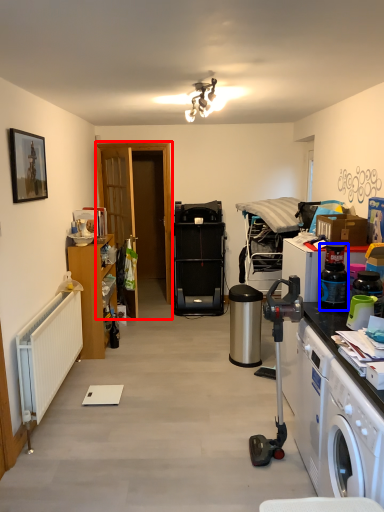
Question: Which object appears closest to the camera in this image, door (highlighted by a red box) or bottle (highlighted by a blue box)?

Choices:
 (A) door
 (B) bottle

Answer: (B)